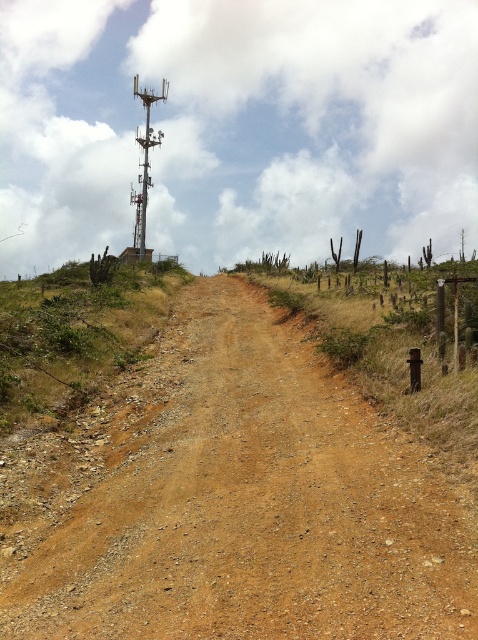
You are a hiker trying to reach the green grassy hillside at upper left from the brown gravelly dirt track at center. Based on the scene, which direction should you head to move from the dirt track towards the hillside?

The brown gravelly dirt track at center is in front of the green grassy hillside at upper left, so to move towards the hillside, you should head towards the upper left direction from the dirt track.

You are a hiker planning to navigate the brown gravelly dirt track at center and the green grassy hillside at upper left. Which terrain feature is located to the right of the other?

The brown gravelly dirt track at center is positioned on the right side of green grassy hillside at upper left, so the dirt track is to the right of the hillside.

You are a hiker planning to walk along the brown gravelly dirt track at center. Given that the track is at coordinates point 0.783, 0.487, can you determine if the path is suitable for a standard hiking boot?

The position of the brown gravelly dirt track at center is at point (232,500), but this coordinate does not provide information about the path surface. The scene describes the path as composed of reddish brown soil and small stones, appearing dry and uneven. Therefore, the path may be suitable for standard hiking boots as they are designed for uneven terrain, but the hiker should be cautious due to the rocky and dry conditions.